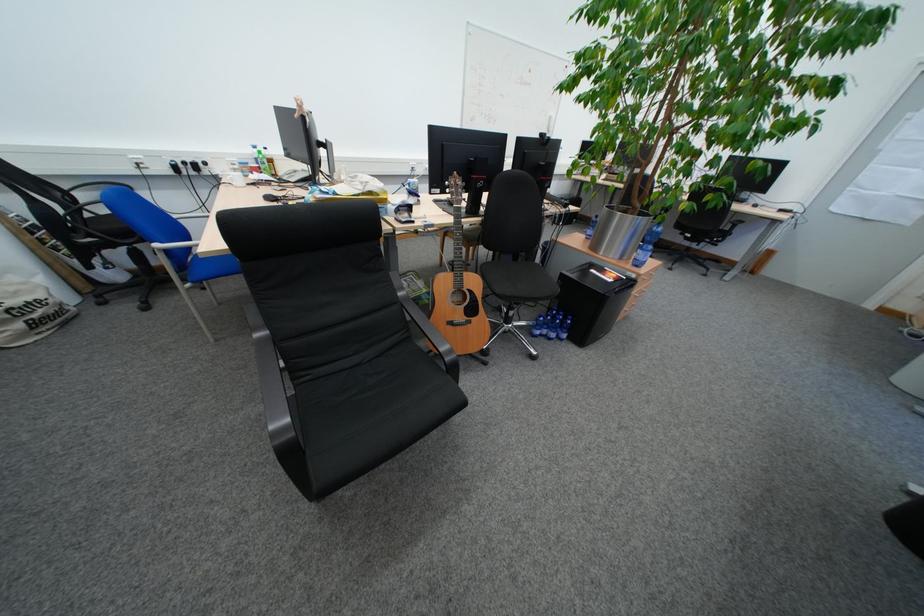
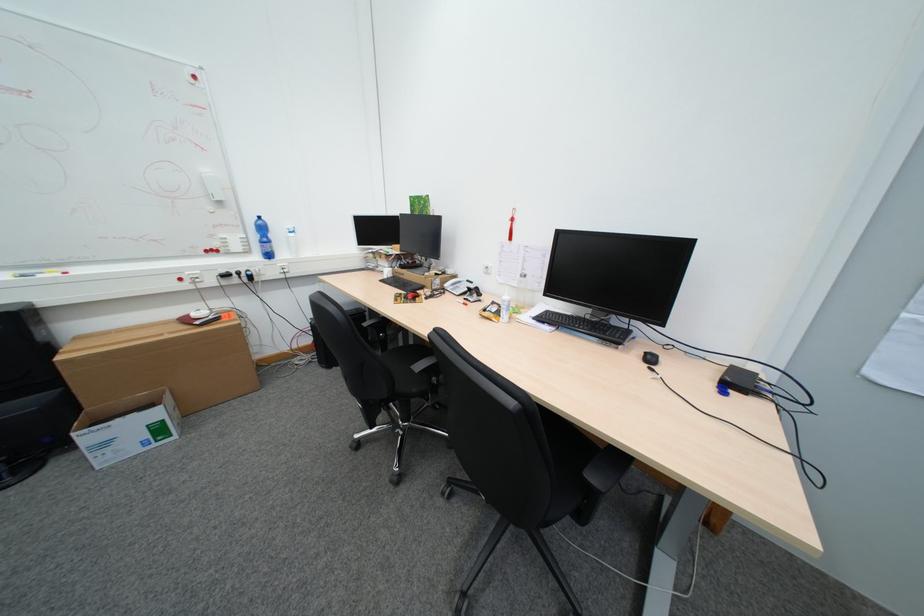
In a continuous first-person perspective shot, in which direction is the camera moving?

The cameraman moved toward right, forward.